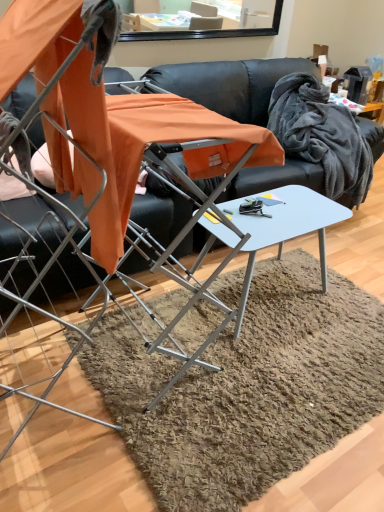
Question: From a real-world perspective, is white glossy table at center positioned above or below metallic silver folding chair at center?

Choices:
 (A) below
 (B) above

Answer: (A)

Question: Considering the positions of white glossy table at center and metallic silver folding chair at center in the image, is white glossy table at center taller or shorter than metallic silver folding chair at center?

Choices:
 (A) short
 (B) tall

Answer: (A)

Question: Based on their relative distances, which object is nearer to the gray fluffy blanket at upper right?

Choices:
 (A) black leather couch at center
 (B) white glossy table at center
 (C) metallic silver folding chair at center

Answer: (A)

Question: Which of these objects is positioned farthest from the black leather couch at center?

Choices:
 (A) gray fluffy blanket at upper right
 (B) metallic silver folding chair at center
 (C) white glossy table at center

Answer: (B)